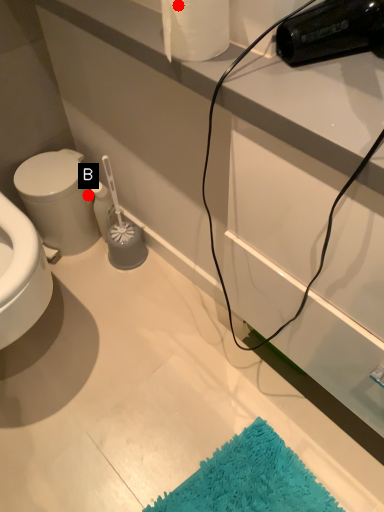
Question: Two points are circled on the image, labeled by A and B beside each circle. Among these points, which one is nearest to the camera?

Choices:
 (A) A is closer
 (B) B is closer

Answer: (A)